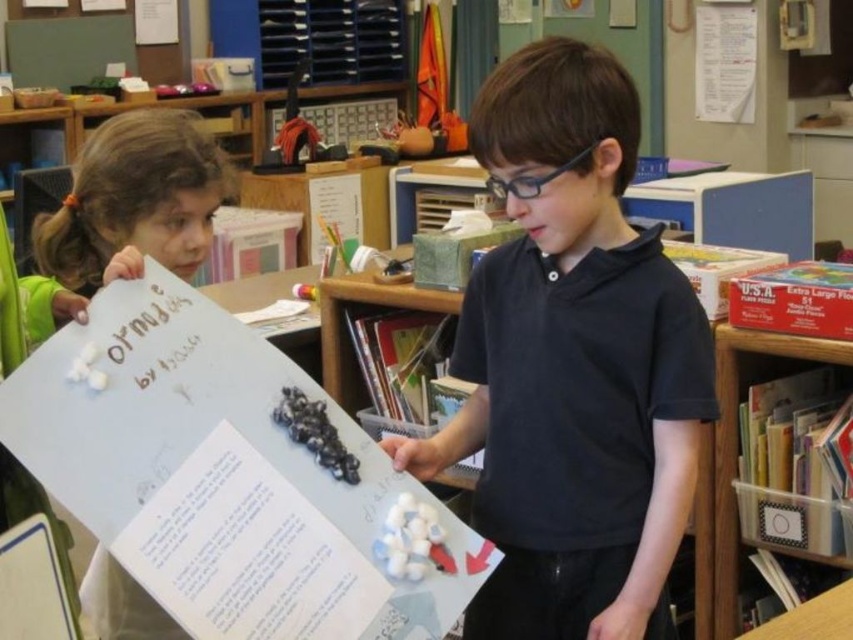
Question: Can you confirm if black matte shirt at center is bigger than clear plastic bin at lower right?

Choices:
 (A) no
 (B) yes

Answer: (B)

Question: Which point appears closest to the camera in this image?

Choices:
 (A) coord(730,403)
 (B) coord(488,122)

Answer: (B)

Question: Which of the following is the farthest from the observer?

Choices:
 (A) (787, 348)
 (B) (546, 502)

Answer: (A)

Question: Does black matte shirt at center have a larger size compared to clear plastic bin at lower right?

Choices:
 (A) yes
 (B) no

Answer: (A)

Question: Does black matte shirt at center appear over clear plastic bin at lower right?

Choices:
 (A) no
 (B) yes

Answer: (B)